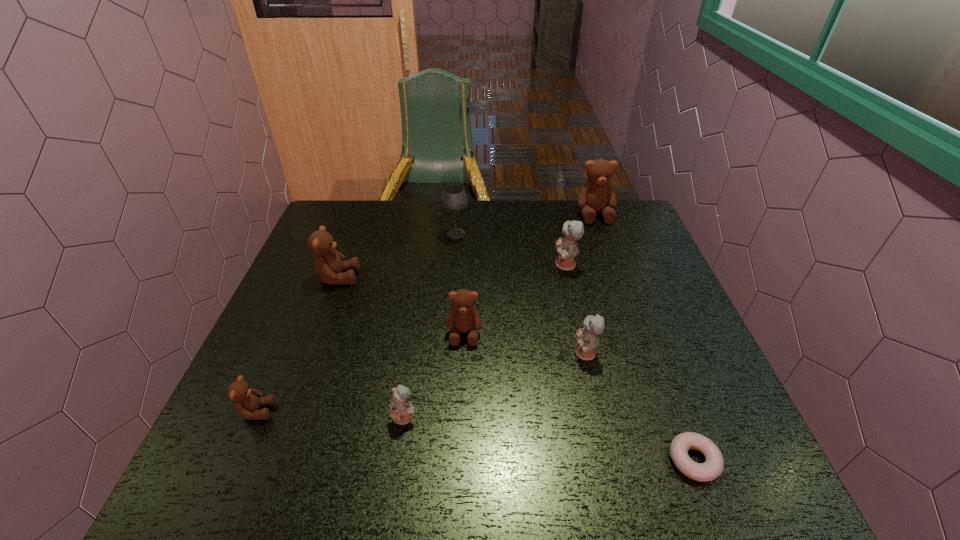
Locate an element on the screen. The image size is (960, 540). vacant point located between the second brown teddy bear from right to left and the biggest blue teddy bear is located at coordinates (515, 299).

I want to click on vacant area that lies between the third nearest brown teddy bear and the smallest brown teddy bear, so click(298, 344).

Locate an element on the screen. vacant point located between the fourth teddy bear from right to left and the nearest object is located at coordinates (579, 397).

The height and width of the screenshot is (540, 960). I want to click on free space between the second biggest blue teddy bear and the smallest brown teddy bear, so click(420, 382).

This screenshot has height=540, width=960. What are the coordinates of `empty location between the brown doughnut and the smallest brown teddy bear` in the screenshot? It's located at (475, 436).

Find the location of `empty space between the doughnut and the farthest brown teddy bear`. empty space between the doughnut and the farthest brown teddy bear is located at coordinates (644, 337).

Find the location of a particular element. The image size is (960, 540). free space between the second farthest object and the rightmost teddy bear is located at coordinates (525, 224).

Locate an element on the screen. This screenshot has width=960, height=540. free space between the brown doughnut and the second smallest blue teddy bear is located at coordinates (639, 407).

The height and width of the screenshot is (540, 960). In order to click on object that ranks as the third closest to the second nearest blue teddy bear in this screenshot , I will do `click(567, 248)`.

Identify which object is the second nearest to the second farthest object. Please provide its 2D coordinates. Your answer should be formatted as a tuple, i.e. [(x, y)], where the tuple contains the x and y coordinates of a point satisfying the conditions above.

[(567, 248)]